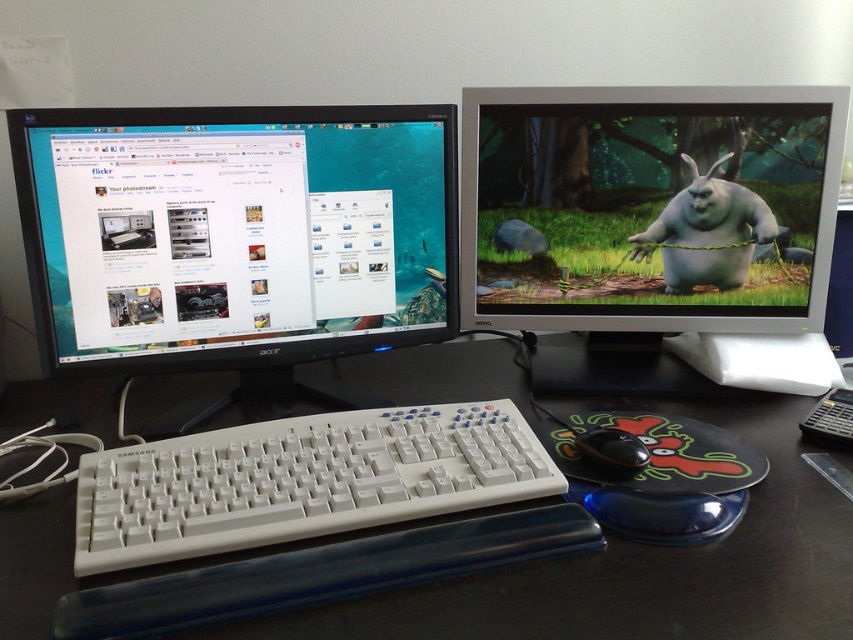
Who is positioned more to the right, black plastic computer desk at center or matte plastic monitor at right?

matte plastic monitor at right is more to the right.

Does black plastic computer desk at center have a greater width compared to matte plastic monitor at right?

Indeed, black plastic computer desk at center has a greater width compared to matte plastic monitor at right.

Who is more distant from viewer, (x=793, y=531) or (x=776, y=282)?

Point (x=776, y=282)

You are a GUI agent. You are given a task and a screenshot of the screen. Output one action in this format:
    pyautogui.click(x=<x>, y=<y>)
    Task: Click on the black plastic computer desk at center
    
    Given the screenshot: What is the action you would take?
    pyautogui.click(x=642, y=563)

Who is lower down, black glossy monitor at left or black plastic mouse at center?

black plastic mouse at center is below.

Between black glossy monitor at left and black plastic mouse at center, which one appears on the left side from the viewer's perspective?

Positioned to the left is black glossy monitor at left.

Does point (410, 124) lie behind point (637, 444)?

Yes.

Image resolution: width=853 pixels, height=640 pixels. In order to click on black glossy monitor at left in this screenshot , I will do `click(235, 230)`.

Which is below, matte plastic monitor at right or white plastic keyboard at center?

Positioned lower is white plastic keyboard at center.

Who is more distant from viewer, (465,310) or (312,452)?

Positioned behind is point (465,310).

The height and width of the screenshot is (640, 853). Identify the location of matte plastic monitor at right. (648, 205).